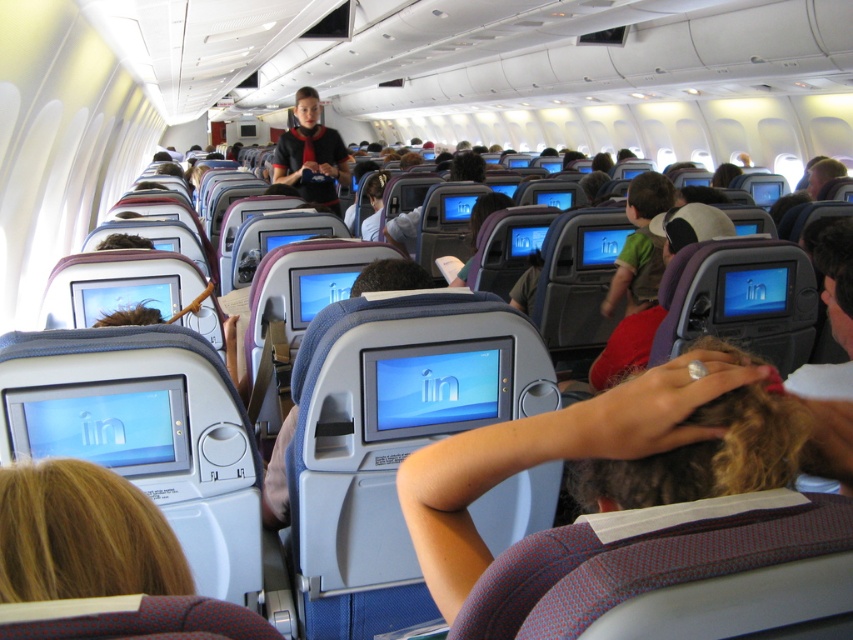
You are a flight attendant standing at the back of the airplane cabin. You need to deliver a drink to the passenger with dark brown hair at center and another to the passenger in matte black uniform at center. Which passenger is closer to you?

The dark brown hair at center is 18.26 feet away from matte black uniform at center. Since you are at the back of the cabin, the passenger in the matte black uniform at center is closer to you because they are positioned between you and the dark brown hair at center.

You are a flight attendant standing at the back of the airplane cabin. You need to locate the passenger with dark brown hair at center and the one in matte black uniform at center. Which object is shorter in height?

The dark brown hair at center has a lesser height compared to the matte black uniform at center, so the dark brown hair at center is shorter in height.